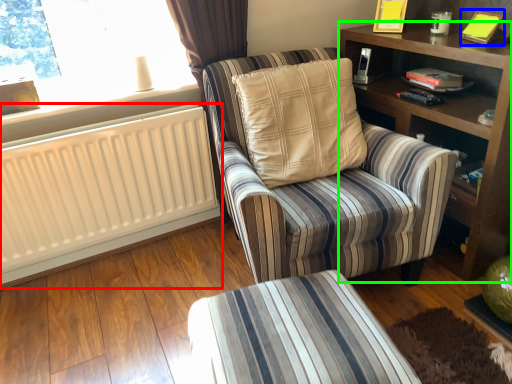
Question: Which is farther away from radiator (highlighted by a red box)? book (highlighted by a blue box) or shelf (highlighted by a green box)?

Choices:
 (A) book
 (B) shelf

Answer: (A)